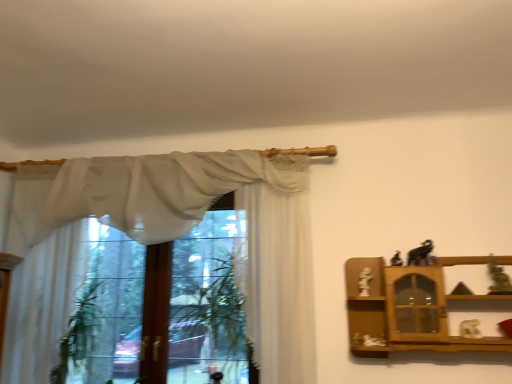
Question: Does matte black elephant at upper right, the fourth toy in the right-to-left sequence, appear on the left side of white sheer curtain at center, placed as the third curtain when sorted from left to right?

Choices:
 (A) yes
 (B) no

Answer: (B)

Question: From the image's perspective, is matte black elephant at upper right, which is the 2th toy in left-to-right order, above white sheer curtain at center, placed as the third curtain when sorted from left to right?

Choices:
 (A) no
 (B) yes

Answer: (B)

Question: Can you confirm if matte black elephant at upper right, the fourth toy in the right-to-left sequence, is smaller than white sheer curtain at center, placed as the third curtain when sorted from left to right?

Choices:
 (A) yes
 (B) no

Answer: (A)

Question: Is matte black elephant at upper right, the fourth toy in the right-to-left sequence, to the right of white sheer curtain at center, which is counted as the 1th curtain, starting from the right, from the viewer's perspective?

Choices:
 (A) no
 (B) yes

Answer: (B)

Question: From a real-world perspective, is matte black elephant at upper right, which is the 2th toy in left-to-right order, located higher than white sheer curtain at center, which is counted as the 1th curtain, starting from the right?

Choices:
 (A) yes
 (B) no

Answer: (A)

Question: From a real-world perspective, is matte black elephant at upper right, the fourth toy in the right-to-left sequence, physically below white sheer curtain at center, which is counted as the 1th curtain, starting from the right?

Choices:
 (A) no
 (B) yes

Answer: (A)

Question: Is the surface of matte gray statue at right, which ranks as the 5th toy in left-to-right order, in direct contact with sheer white curtain at upper left, which is the second curtain from right to left?

Choices:
 (A) yes
 (B) no

Answer: (B)

Question: From a real-world perspective, does matte gray statue at right, which ranks as the 5th toy in left-to-right order, sit lower than sheer white curtain at upper left, which is the 2th curtain in left-to-right order?

Choices:
 (A) no
 (B) yes

Answer: (B)

Question: From the image's perspective, does matte gray statue at right, which ranks as the 5th toy in left-to-right order, appear lower than sheer white curtain at upper left, which is the 2th curtain in left-to-right order?

Choices:
 (A) yes
 (B) no

Answer: (A)

Question: Is matte gray statue at right, which ranks as the 5th toy in left-to-right order, aimed at sheer white curtain at upper left, which is the second curtain from right to left?

Choices:
 (A) yes
 (B) no

Answer: (B)

Question: Does matte gray statue at right, the 1th toy when ordered from right to left, have a lesser width compared to sheer white curtain at upper left, which is the second curtain from right to left?

Choices:
 (A) no
 (B) yes

Answer: (B)

Question: Is matte gray statue at right, the 1th toy when ordered from right to left, to the right of sheer white curtain at upper left, which is the 2th curtain in left-to-right order, from the viewer's perspective?

Choices:
 (A) no
 (B) yes

Answer: (B)

Question: From the image's perspective, does matte black elephant at upper right, the fourth toy in the right-to-left sequence, appear lower than matte black elephant at upper right, positioned as the 3th toy in left-to-right order?

Choices:
 (A) yes
 (B) no

Answer: (A)